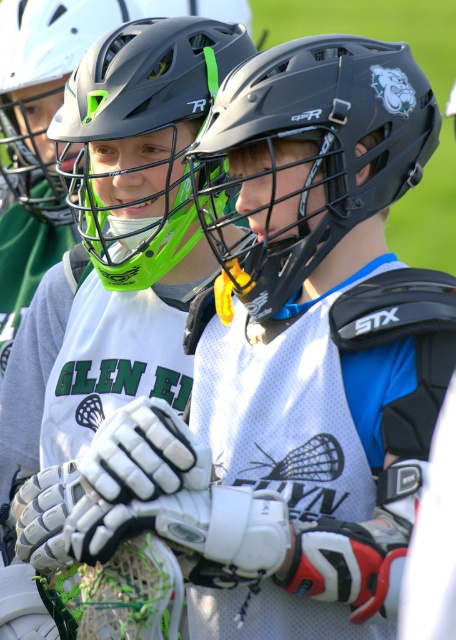
Question: Does white matte lacrosse glove at center have a greater width compared to black matte helmet at center?

Choices:
 (A) yes
 (B) no

Answer: (A)

Question: Which point is closer to the camera?

Choices:
 (A) white matte lacrosse glove at center
 (B) matte black helmet at upper center

Answer: (B)

Question: Which is farther from the black matte helmet at center?

Choices:
 (A) white matte lacrosse glove at center
 (B) matte black helmet at upper center

Answer: (A)

Question: Which point is closer to the camera?

Choices:
 (A) (186, 72)
 (B) (359, 61)
 (C) (190, 51)

Answer: (B)

Question: Does white matte lacrosse glove at center have a greater width compared to matte black helmet at upper center?

Choices:
 (A) yes
 (B) no

Answer: (A)

Question: Is white matte lacrosse glove at center wider than matte black helmet at upper center?

Choices:
 (A) no
 (B) yes

Answer: (B)